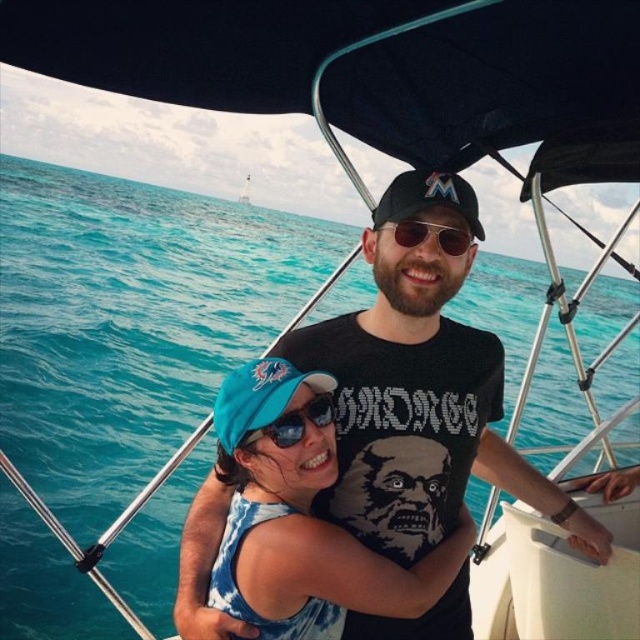
You are standing on the deck of the boat and want to reach the point marked at coordinates point [285,433]. If your arm can reach 1.8 meters, can you reach that point without moving?

The point [285,433] is 2.20 meters away from the camera, so no, you cannot reach it with an arm span of 1.8 meters.

You are a photographer taking a picture of the two people on the boat. You want to focus on the person in the foreground wearing the black T shirt and the person behind them in the blue tie dye tank top. Which of the two points, point (396, 611) or point (285, 426), is closer to the camera?

Point (396, 611) is further to the camera than point (285, 426), so point (396, 611) is closer to the camera.